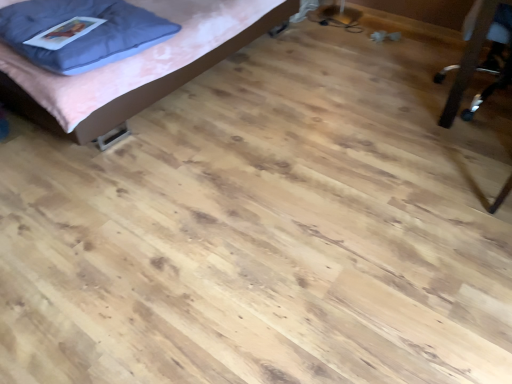
I want to click on empty space that is in between matte pink bed at upper left and metallic silver chair at right, so click(x=320, y=98).